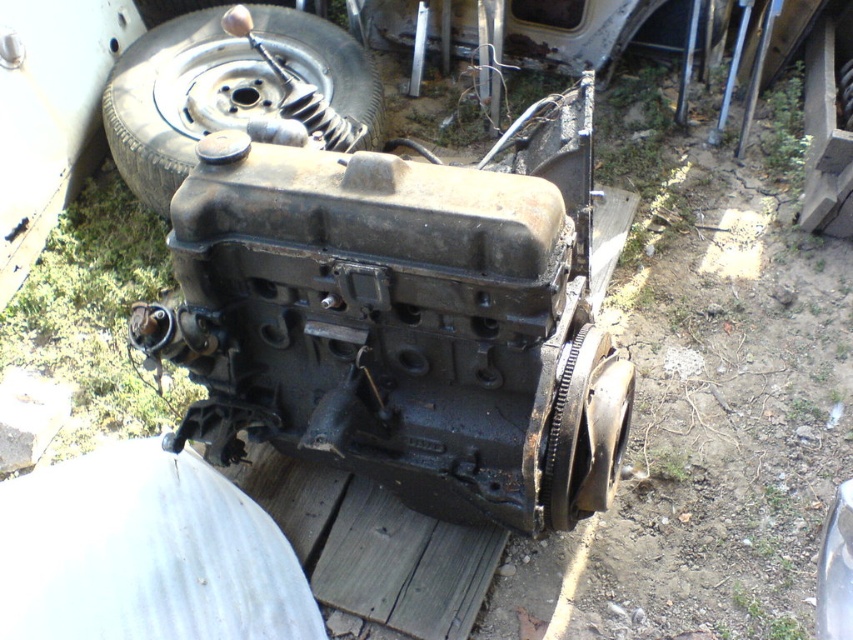
This screenshot has height=640, width=853. Describe the element at coordinates (403, 317) in the screenshot. I see `rusty metal engine at center` at that location.

At what (x,y) coordinates should I click in order to perform the action: click on rusty metal engine at center. Please return your answer as a coordinate pair (x, y). Image resolution: width=853 pixels, height=640 pixels. Looking at the image, I should click on (403, 317).

This screenshot has height=640, width=853. I want to click on rusty metal engine at center, so click(x=403, y=317).